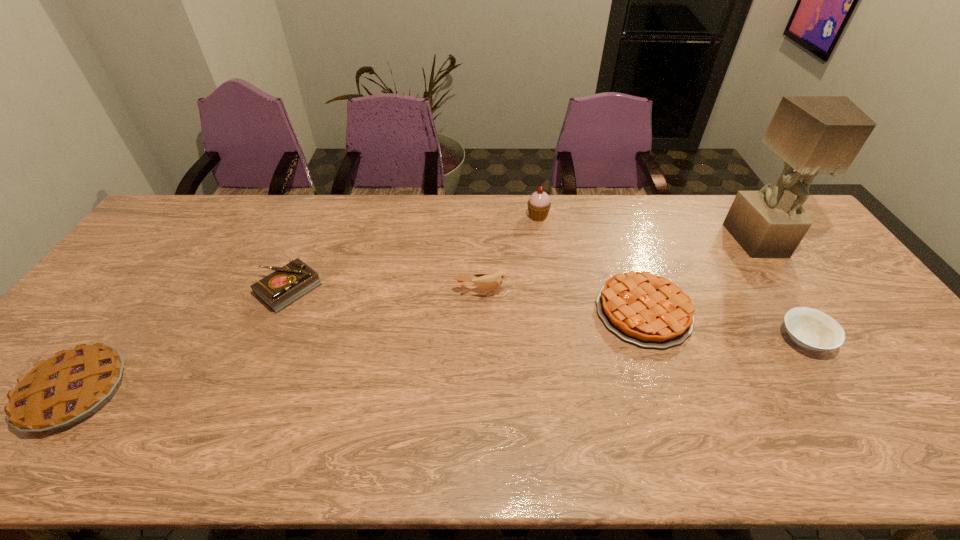
Identify the location of vacant space at the far edge. The image size is (960, 540). (444, 235).

Identify the location of vacant area at the near edge of the desktop. This screenshot has height=540, width=960. (236, 438).

The image size is (960, 540). Find the location of `vacant space at the left edge`. vacant space at the left edge is located at coordinates (129, 288).

Identify the location of vacant space at the right edge of the desktop. (858, 368).

Where is `vacant space at the far left corner of the desktop`? This screenshot has height=540, width=960. vacant space at the far left corner of the desktop is located at coordinates (203, 197).

Find the location of a particular element. This screenshot has width=960, height=540. vacant region between the right pie and the third tallest object is located at coordinates (564, 302).

Where is `free area in between the fifth object from right to left and the diary`? The width and height of the screenshot is (960, 540). free area in between the fifth object from right to left and the diary is located at coordinates (386, 291).

The height and width of the screenshot is (540, 960). I want to click on free spot between the fifth shortest object and the farther pie, so click(x=564, y=302).

Image resolution: width=960 pixels, height=540 pixels. In order to click on blank region between the tallest object and the bowl in this screenshot , I will do `click(781, 291)`.

The height and width of the screenshot is (540, 960). What are the coordinates of `empty location between the fourth object from left to right and the bowl` in the screenshot? It's located at point(671,278).